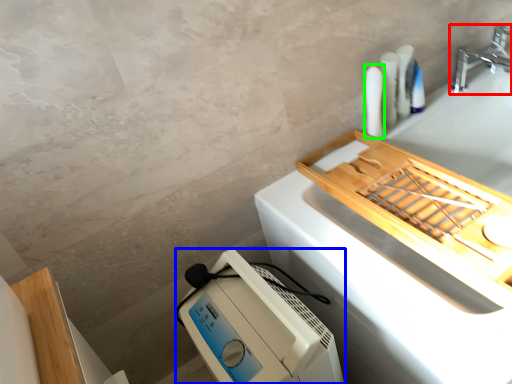
Question: Considering the real-world distances, which object is closest to tap (highlighted by a red box)? home appliance (highlighted by a blue box) or toiletry (highlighted by a green box).

Choices:
 (A) home appliance
 (B) toiletry

Answer: (B)